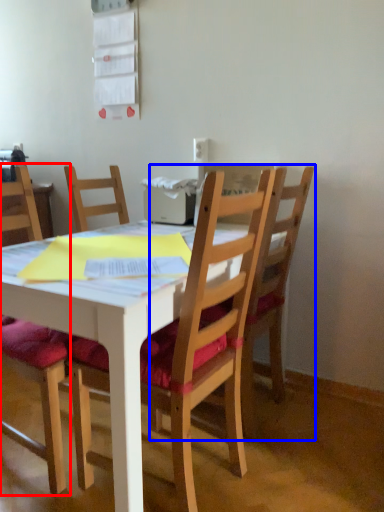
Question: Which point is closer to the camera, chair (highlighted by a red box) or chair (highlighted by a blue box)?

Choices:
 (A) chair
 (B) chair

Answer: (A)